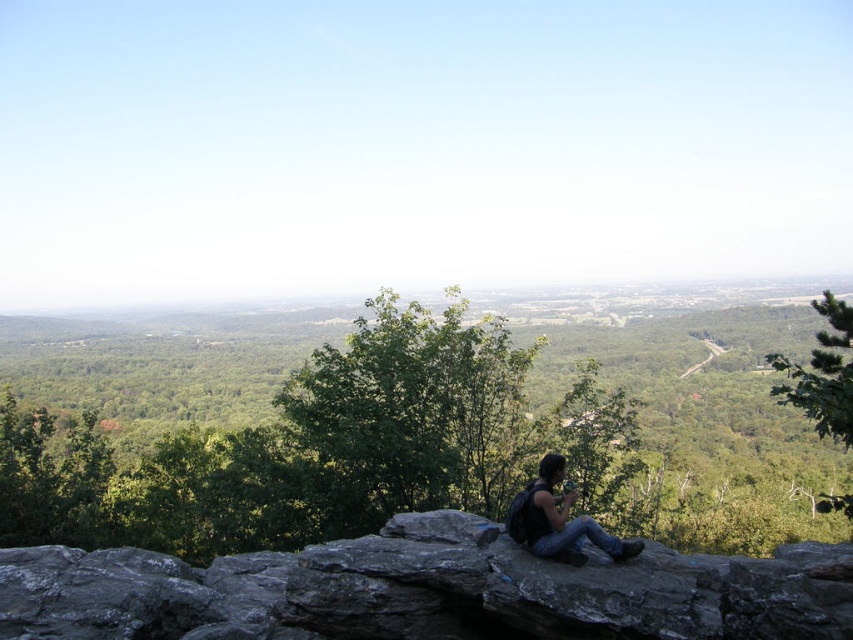
Question: Is green leafy tree at upper right thinner than black backpack at center?

Choices:
 (A) no
 (B) yes

Answer: (A)

Question: Is dark gray rocky cliff at center below green leafy tree at upper right?

Choices:
 (A) yes
 (B) no

Answer: (A)

Question: Among these objects, which one is nearest to the camera?

Choices:
 (A) green leafy tree at upper right
 (B) green leafy tree at center
 (C) dark gray rocky cliff at center
 (D) black backpack at center

Answer: (C)

Question: Among these objects, which one is farthest from the camera?

Choices:
 (A) green leafy tree at center
 (B) green leafy tree at upper right
 (C) dark gray rocky cliff at center

Answer: (A)

Question: Does green leafy tree at center appear on the right side of green leafy tree at upper right?

Choices:
 (A) yes
 (B) no

Answer: (B)

Question: Considering the real-world distances, which object is closest to the green leafy tree at upper right?

Choices:
 (A) green leafy tree at center
 (B) dark gray rocky cliff at center

Answer: (B)